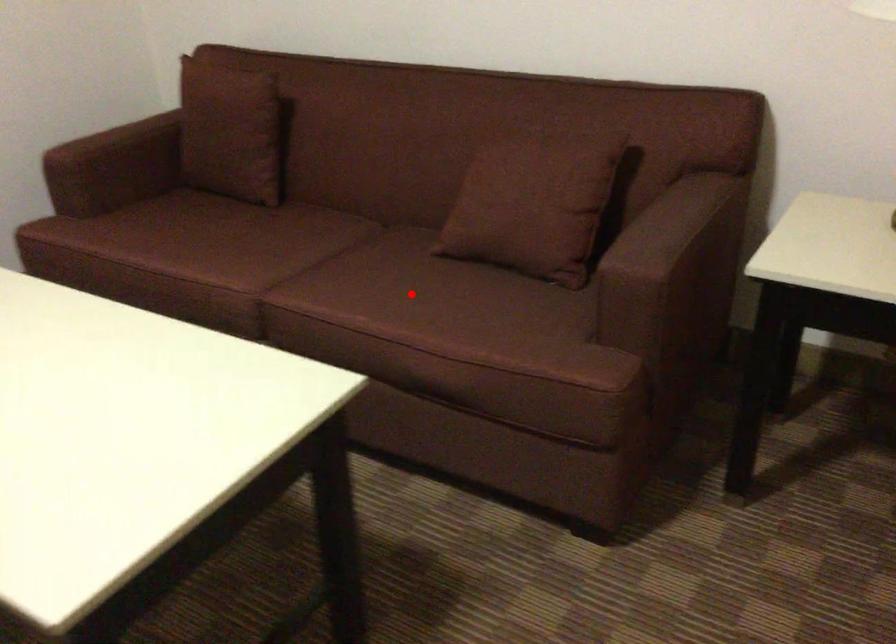
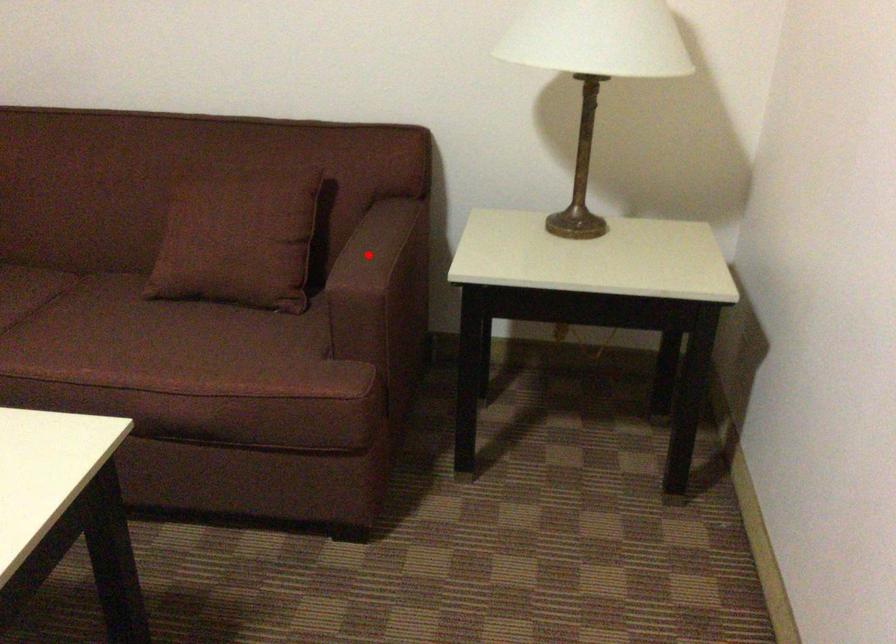
I am providing you with two images of the same scene from different viewpoints. A red point is marked on the first image and another point is marked on the second image. Is the marked point in image1 the same physical position as the marked point in image2?

No